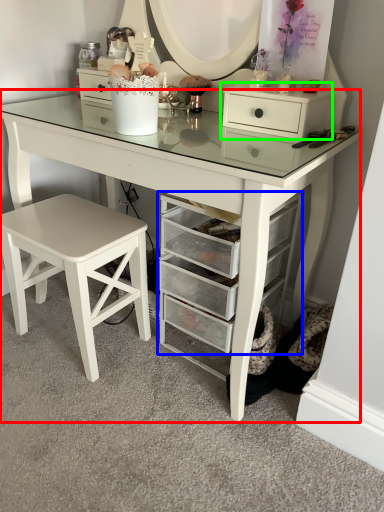
Question: Based on their relative distances, which object is farther from table (highlighted by a red box)? Choose from shelf (highlighted by a blue box) and chest of drawers (highlighted by a green box).

Choices:
 (A) shelf
 (B) chest of drawers

Answer: (B)